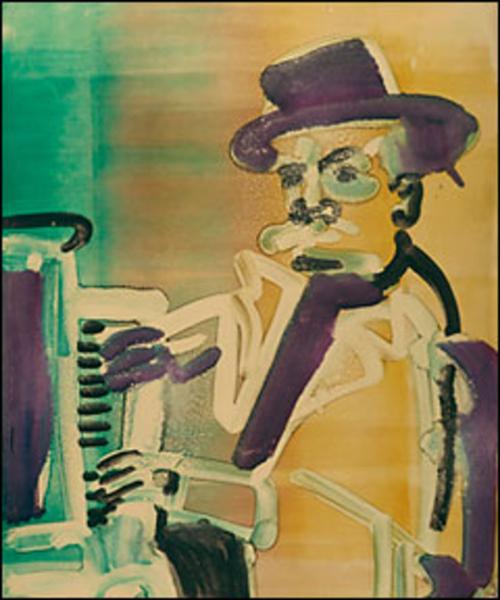
You are a GUI agent. You are given a task and a screenshot of the screen. Output one action in this format:
    pyautogui.click(x=<x>, y=<y>)
    Task: Click on the chair
    The height and width of the screenshot is (600, 500).
    Given the screenshot: What is the action you would take?
    pyautogui.click(x=487, y=385)